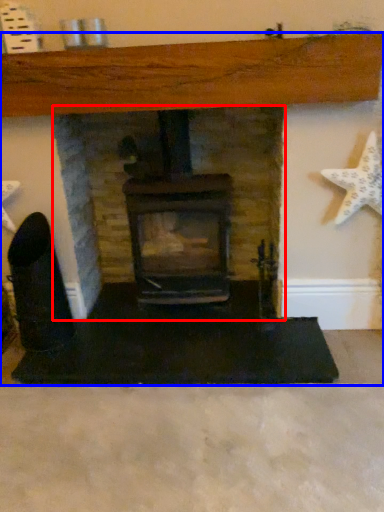
Question: Which object appears farthest to the camera in this image, fireplace (highlighted by a red box) or fireplace (highlighted by a blue box)?

Choices:
 (A) fireplace
 (B) fireplace

Answer: (A)